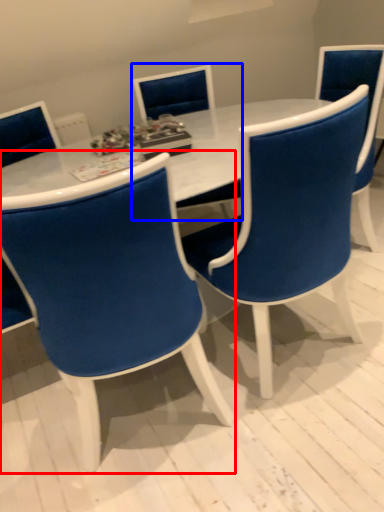
Question: Which of the following is the closest to the observer, chair (highlighted by a red box) or chair (highlighted by a blue box)?

Choices:
 (A) chair
 (B) chair

Answer: (A)